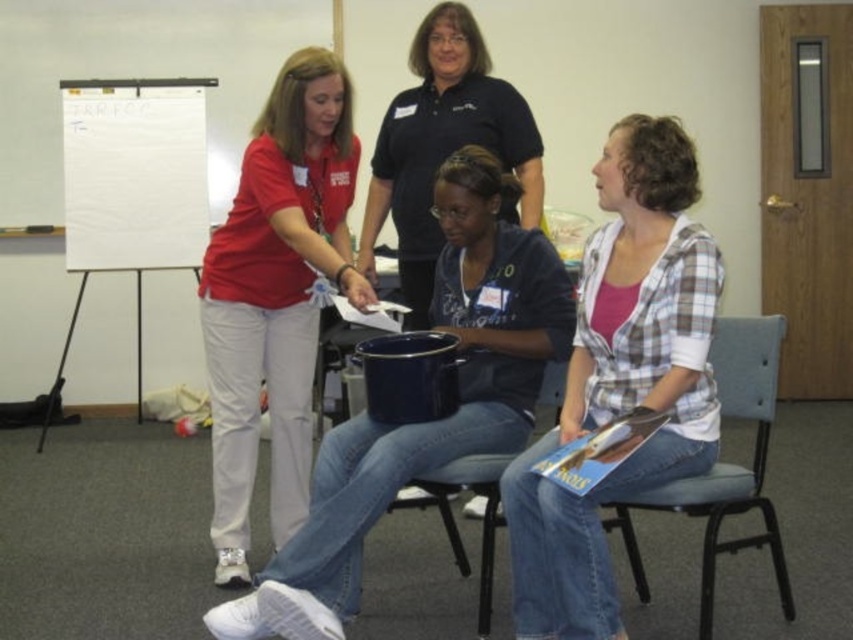
Question: Which of these objects is positioned closest to the blue plastic chair at center?

Choices:
 (A) matte blue bucket at center
 (B) matte red shirt at center
 (C) plaid cotton shirt at center
 (D) matte black shirt at center

Answer: (A)

Question: Can you confirm if plaid cotton shirt at center is positioned above blue fabric chair at right?

Choices:
 (A) yes
 (B) no

Answer: (A)

Question: Can you confirm if plaid cotton shirt at center is wider than blue fabric chair at right?

Choices:
 (A) yes
 (B) no

Answer: (B)

Question: Which point is farther to the camera?

Choices:
 (A) (334, 525)
 (B) (486, 100)
 (C) (100, 106)

Answer: (C)

Question: Which object is positioned farthest from the plaid cotton shirt at center?

Choices:
 (A) blue fabric chair at right
 (B) matte black shirt at center
 (C) matte red shirt at center

Answer: (B)

Question: From the image, what is the correct spatial relationship of plaid cotton shirt at center in relation to blue plastic chair at center?

Choices:
 (A) above
 (B) below

Answer: (A)